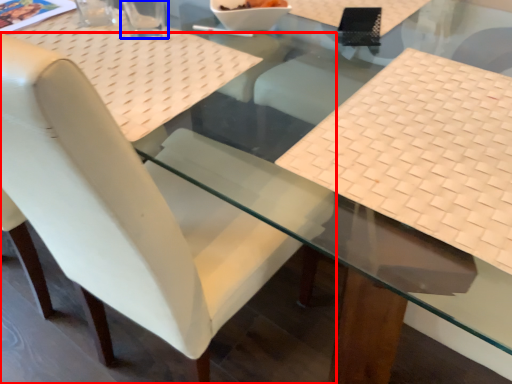
Question: Which of the following is the closest to the observer, chair (highlighted by a red box) or clear (highlighted by a blue box)?

Choices:
 (A) chair
 (B) clear

Answer: (A)